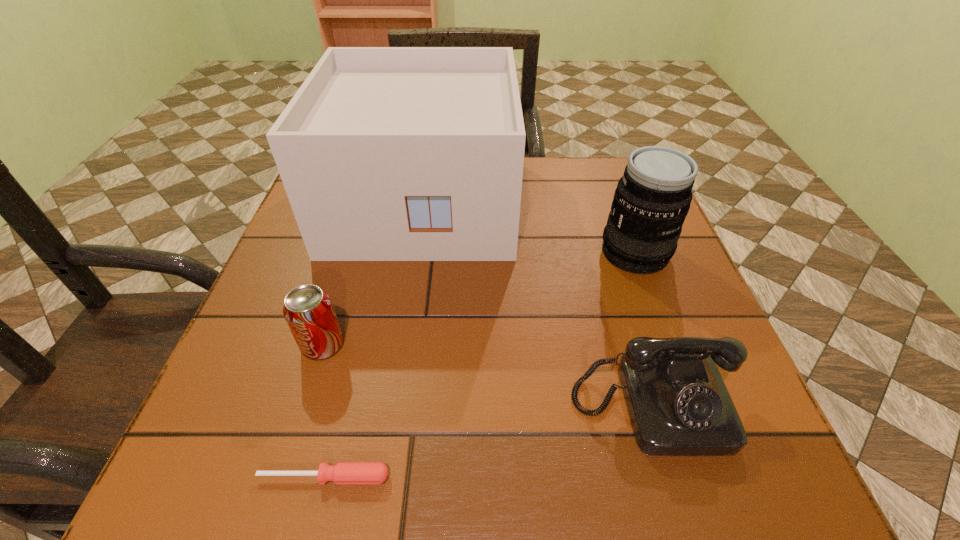
Find the location of a particular element. This screenshot has height=540, width=960. vacant space in between the soda can and the nearest object is located at coordinates (324, 411).

I want to click on free point between the second tallest object and the third farthest object, so click(479, 299).

Locate an element on the screen. free spot between the soda can and the fourth shortest object is located at coordinates (x=479, y=299).

What are the coordinates of `free area in between the tallest object and the fourth farthest object` in the screenshot? It's located at (538, 303).

Where is `vacant space that's between the third farthest object and the telephoto lens`? This screenshot has height=540, width=960. vacant space that's between the third farthest object and the telephoto lens is located at coordinates (479, 299).

The height and width of the screenshot is (540, 960). Find the location of `free spot between the fourth shortest object and the telephone`. free spot between the fourth shortest object and the telephone is located at coordinates (643, 329).

Select which object is the second closest to the telephone. Please provide its 2D coordinates. Your answer should be formatted as a tuple, i.e. [(x, y)], where the tuple contains the x and y coordinates of a point satisfying the conditions above.

[(386, 153)]

Identify which object is located as the fourth nearest to the telephoto lens. Please provide its 2D coordinates. Your answer should be formatted as a tuple, i.e. [(x, y)], where the tuple contains the x and y coordinates of a point satisfying the conditions above.

[(343, 472)]

What are the coordinates of `blank area in the image that satisfies the following two spatial constraints: 1. on the back side of the telephoto lens; 2. on the left side of the nearest object` in the screenshot? It's located at (379, 253).

I want to click on vacant region that satisfies the following two spatial constraints: 1. on the back side of the second tallest object; 2. on the right side of the third farthest object, so click(x=351, y=253).